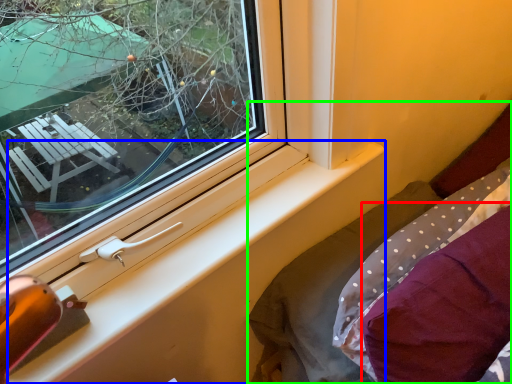
Question: Based on their relative distances, which object is nearer to pillow (highlighted by a red box)? Choose from window sill (highlighted by a blue box) and bed (highlighted by a green box).

Choices:
 (A) window sill
 (B) bed

Answer: (B)